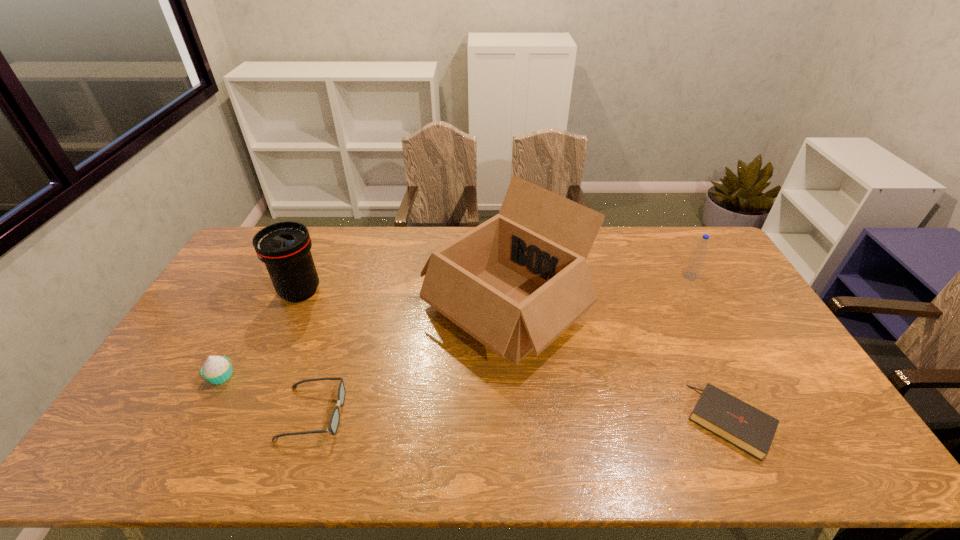
At what (x,y) coordinates should I click in order to perform the action: click on vacant point located between the third tallest object and the shortest object. Please return your answer as a coordinate pair (x, y). The width and height of the screenshot is (960, 540). Looking at the image, I should click on (710, 348).

Where is `empty space that is in between the cupcake and the Bible`? Image resolution: width=960 pixels, height=540 pixels. empty space that is in between the cupcake and the Bible is located at coordinates (475, 398).

Find the location of a particular element. The image size is (960, 540). free space between the telephoto lens and the spectacles is located at coordinates (306, 353).

Identify the location of free space between the telephoto lens and the second shortest object. The width and height of the screenshot is (960, 540). (306, 353).

I want to click on object identified as the fifth closest to the Bible, so click(x=217, y=369).

Choose which object is the third nearest neighbor to the fourth tallest object. Please provide its 2D coordinates. Your answer should be formatted as a tuple, i.e. [(x, y)], where the tuple contains the x and y coordinates of a point satisfying the conditions above.

[(516, 282)]

Image resolution: width=960 pixels, height=540 pixels. In order to click on free location that satisfies the following two spatial constraints: 1. on the face of the spectacles; 2. on the right side of the Bible in this screenshot , I will do `click(311, 421)`.

The height and width of the screenshot is (540, 960). In order to click on vacant position in the image that satisfies the following two spatial constraints: 1. on the front side of the telephoto lens; 2. on the right side of the Bible in this screenshot , I will do `click(242, 421)`.

I want to click on free spot that satisfies the following two spatial constraints: 1. on the front side of the Bible; 2. on the left side of the tallest object, so click(512, 421).